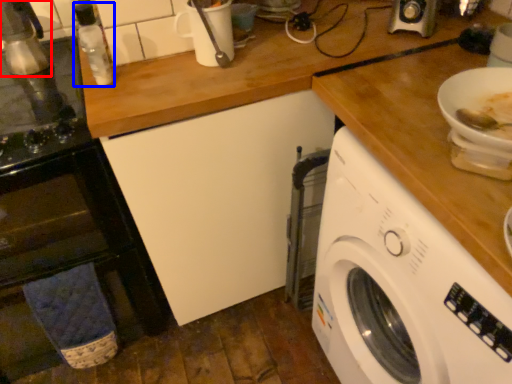
Question: Which of the following is the closest to the observer, appliance (highlighted by a red box) or bottle (highlighted by a blue box)?

Choices:
 (A) appliance
 (B) bottle

Answer: (A)